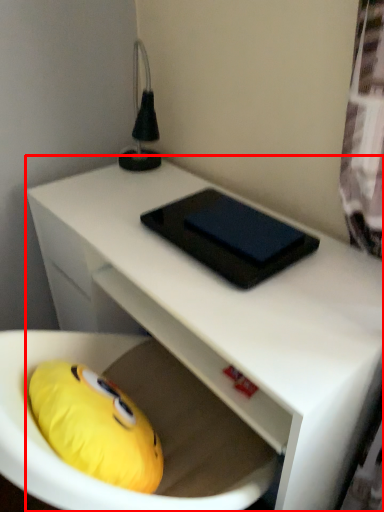
Question: Where is desk (annotated by the red box) located in relation to pad in the image?

Choices:
 (A) left
 (B) right

Answer: (A)